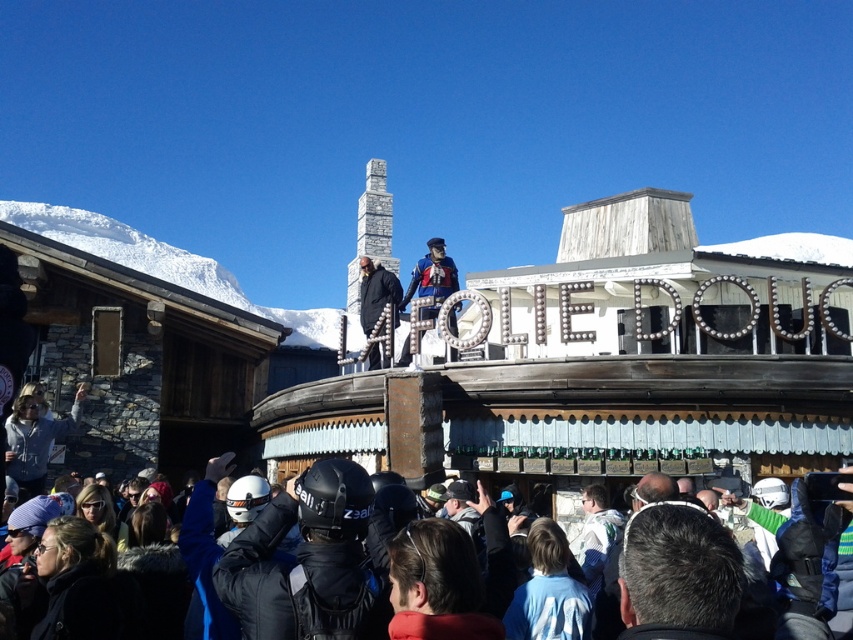
You are a photographer at the event and want to capture a clear shot of the dark brown hair at center and the black matte coat at center. Since you can only focus on one subject at a time, which one should you focus on to ensure the other is in the background?

You should focus on the black matte coat at center because the dark brown hair at center is positioned under it, meaning the dark brown hair at center will be in the background if the black matte coat at center is in focus.

You are a photographer at the event and want to capture both the dark brown hair at center and the black matte coat at center in the same frame. Which object should you focus on first to ensure both are in focus?

The dark brown hair at center is thinner than the black matte coat at center, so you should focus on the black matte coat at center first as it has a larger surface area, making it easier to achieve focus before adjusting for the thinner dark brown hair at center.